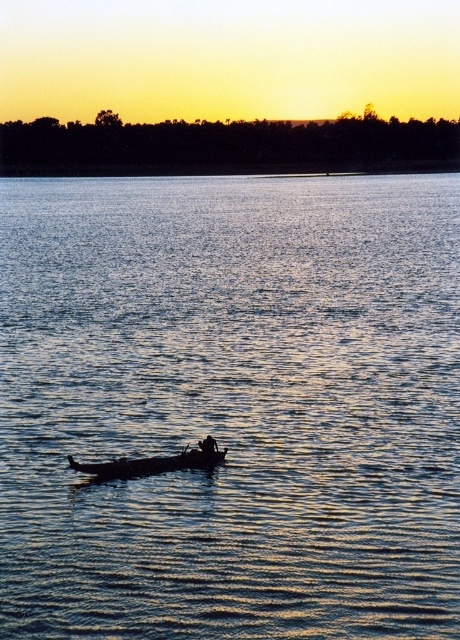
You are standing on the shore looking at the blue water at center and the wooden boat at center. Which object is positioned higher in the image?

The blue water at center is located above the wooden boat at center, so it is positioned higher in the image.

You are planning to take a photo of the wooden boat at center and the dark skin textured person at center from the shore. Which object should you focus on first if you want to capture both in one frame without moving the camera?

You should focus on the wooden boat at center first because it is wider than the dark skin textured person at center, so it will occupy more space in the frame and ensure both are captured without needing to adjust the camera position.